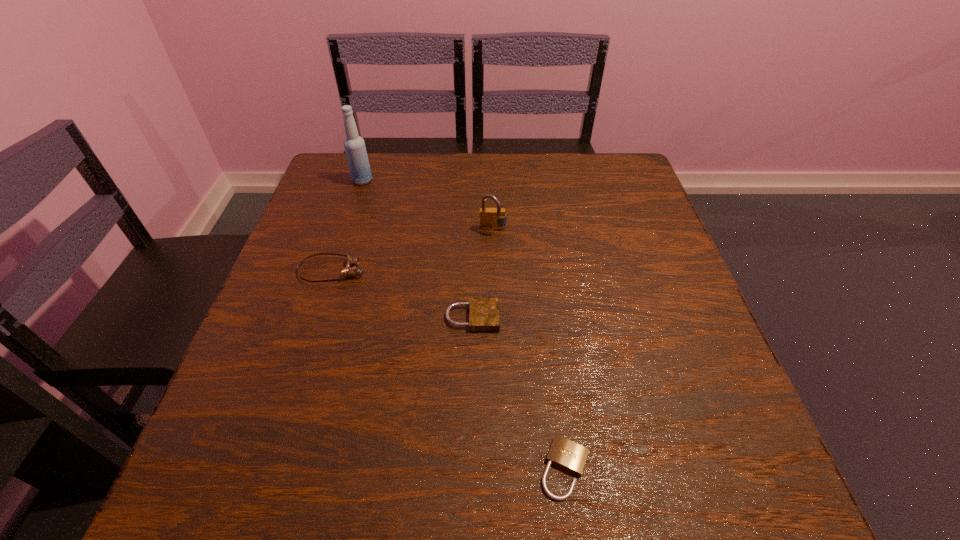
Where is `free spot located 0.150m on the front of the bottle`? free spot located 0.150m on the front of the bottle is located at coordinates (348, 224).

Where is `vacant space located on the side with the combination dials of the fourth shortest object`? The height and width of the screenshot is (540, 960). vacant space located on the side with the combination dials of the fourth shortest object is located at coordinates (497, 370).

This screenshot has height=540, width=960. What are the coordinates of `free region located 0.380m on the front lenses and sides of the goggles` in the screenshot? It's located at pos(549,271).

You are a GUI agent. You are given a task and a screenshot of the screen. Output one action in this format:
    pyautogui.click(x=<x>, y=<y>)
    Task: Click on the free space located on the keyhole side of the second nearest padlock
    
    Given the screenshot: What is the action you would take?
    pyautogui.click(x=552, y=317)

Where is `vacant area situated 0.360m on the back of the nearest padlock`? vacant area situated 0.360m on the back of the nearest padlock is located at coordinates [540, 269].

This screenshot has width=960, height=540. I want to click on object located in the far edge section of the desktop, so click(354, 145).

I want to click on object at the near edge, so click(x=564, y=453).

This screenshot has height=540, width=960. Find the location of `bottle that is at the left edge`. bottle that is at the left edge is located at coordinates [354, 145].

You are a GUI agent. You are given a task and a screenshot of the screen. Output one action in this format:
    pyautogui.click(x=<x>, y=<y>)
    Task: Click on the goggles at the left edge
    This screenshot has width=960, height=540.
    Given the screenshot: What is the action you would take?
    pyautogui.click(x=347, y=271)

This screenshot has width=960, height=540. In order to click on object that is at the far left corner in this screenshot , I will do `click(354, 145)`.